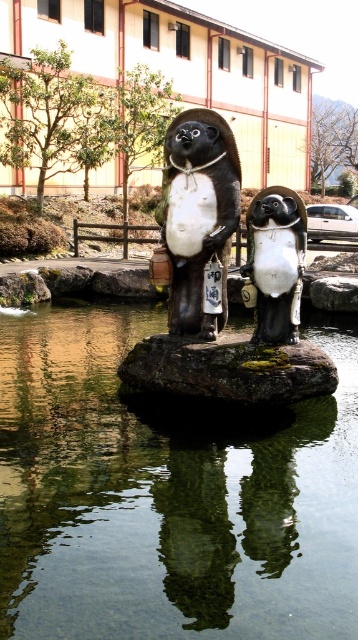
Which is above, clear water at center or matte black penguin at center?

matte black penguin at center

Is clear water at center above matte black penguin at center?

No.

Locate an element on the screen. The width and height of the screenshot is (358, 640). clear water at center is located at coordinates (167, 496).

Which is in front, point (312, 525) or point (168, 200)?

Positioned in front is point (312, 525).

Locate an element on the screen. The image size is (358, 640). clear water at center is located at coordinates (167, 496).

Does shiny bronze penguin at center have a smaller size compared to matte black penguin at center?

Incorrect, shiny bronze penguin at center is not smaller in size than matte black penguin at center.

Measure the distance between shiny bronze penguin at center and camera.

A distance of 6.36 meters exists between shiny bronze penguin at center and camera.

This screenshot has height=640, width=358. Describe the element at coordinates (224, 280) in the screenshot. I see `shiny bronze penguin at center` at that location.

Locate an element on the screen. The image size is (358, 640). shiny bronze penguin at center is located at coordinates (224, 280).